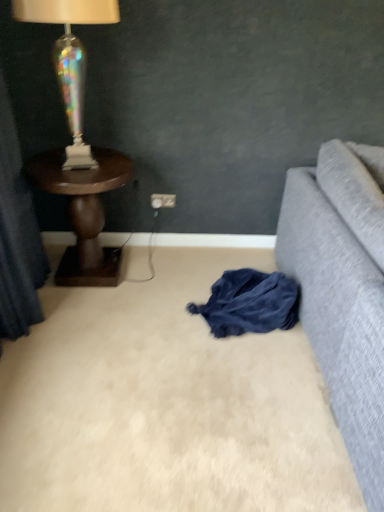
You are a GUI agent. You are given a task and a screenshot of the screen. Output one action in this format:
    pyautogui.click(x=<x>, y=<y>)
    Task: Click on the free point above dark wood side table at left (from a real-world perspective)
    
    Given the screenshot: What is the action you would take?
    pyautogui.click(x=77, y=168)